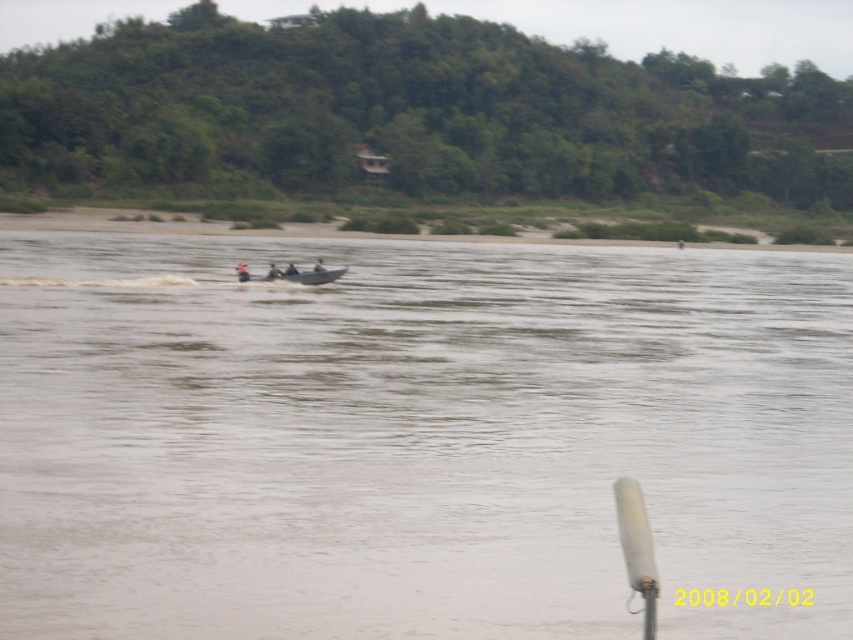
You are a safety inspector reviewing a boating scene. You notice an orange life vest at center and a dark blue fabric person at center. Which object is bigger in size?

The orange life vest at center is larger in size than the dark blue fabric person at center.

You are navigating a drone that needs to fly from the point at (238, 268) to the point at (285, 268). According to the scene, which direction should the drone move relative to the motorboat in the middle?

The drone should move backward relative to the motorboat in the middle because point (238, 268) is in front of point (285, 268).